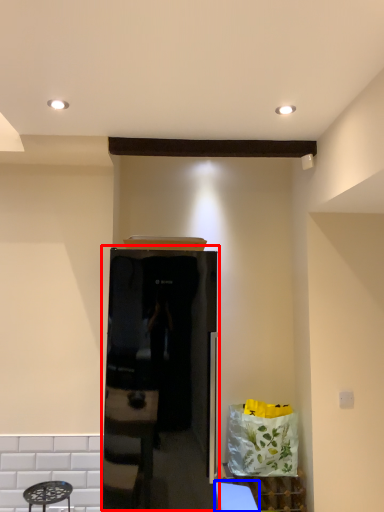
Question: Which of the following is the closest to the observer, appliance (highlighted by a red box) or table (highlighted by a blue box)?

Choices:
 (A) appliance
 (B) table

Answer: (A)